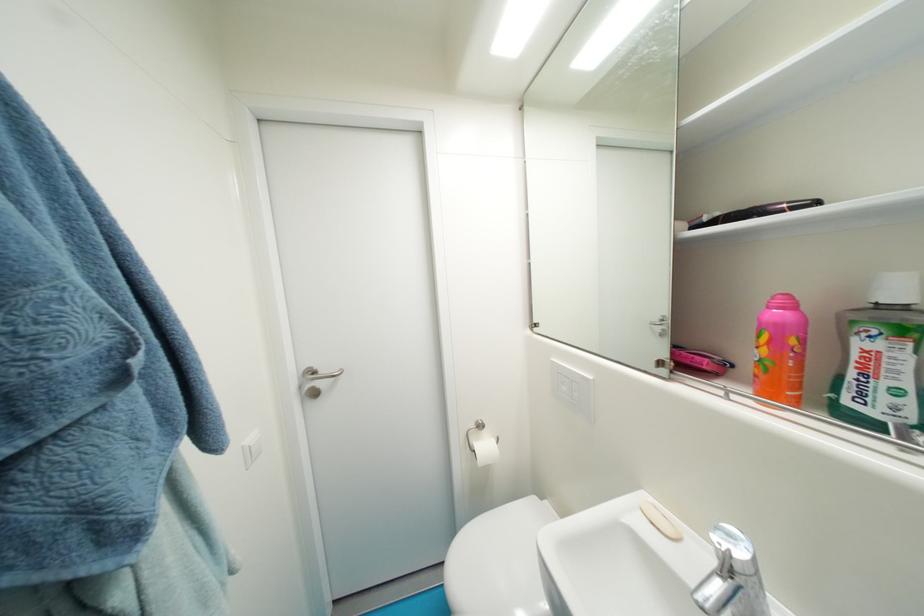
Find where to push the white light switch. Please return your answer as a coordinate pair (x, y).

(568, 390)